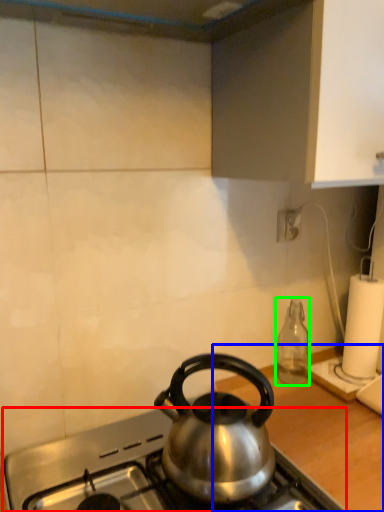
Question: Which is farther away from gas stove (highlighted by a red box)? counter top (highlighted by a blue box) or bottle (highlighted by a green box)?

Choices:
 (A) counter top
 (B) bottle

Answer: (B)